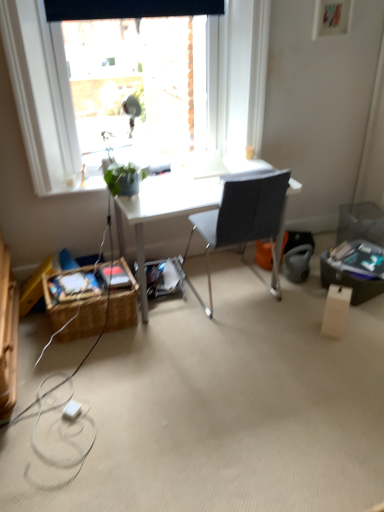
Describe the element at coordinates (40, 92) in the screenshot. I see `transparent glass window at upper center` at that location.

Image resolution: width=384 pixels, height=512 pixels. What do you see at coordinates (336, 311) in the screenshot? I see `white cardboard box at lower right` at bounding box center [336, 311].

Identify the location of gray fabric chair at center. [242, 220].

Where is `green matte plant at upper left`? The image size is (384, 512). green matte plant at upper left is located at coordinates (124, 178).

Where is `transparent glass window at upper center`? This screenshot has width=384, height=512. transparent glass window at upper center is located at coordinates (40, 92).

Is green matte plant at upper left completely or partially outside of white cardboard box at lower right?

green matte plant at upper left is positioned outside white cardboard box at lower right.

In the image, is green matte plant at upper left positioned in front of or behind white cardboard box at lower right?

In the image, green matte plant at upper left appears in front of white cardboard box at lower right.

Is green matte plant at upper left placed right next to white cardboard box at lower right?

No, green matte plant at upper left is not in contact with white cardboard box at lower right.

Considering the positions of objects green matte plant at upper left and white cardboard box at lower right in the image provided, who is more to the left, green matte plant at upper left or white cardboard box at lower right?

green matte plant at upper left is more to the left.

Can you confirm if gray fabric chair at center is positioned to the right of wooden picture frame at upper right?

No.

From a real-world perspective, between gray fabric chair at center and wooden picture frame at upper right, who is vertically lower?

gray fabric chair at center.

Is gray fabric chair at center oriented towards wooden picture frame at upper right?

No.

From the image's perspective, does gray fabric chair at center appear higher than wooden picture frame at upper right?

No, from the image's perspective, gray fabric chair at center is not over wooden picture frame at upper right.

Who is taller, woven brown picnic basket at lower left or white plastic power outlet at lower left?

Standing taller between the two is woven brown picnic basket at lower left.

From a real-world perspective, between woven brown picnic basket at lower left and white plastic power outlet at lower left, who is vertically higher?

In real-world perspective, woven brown picnic basket at lower left is above.

Is transparent glass window at upper center spatially inside white plastic power outlet at lower left, or outside of it?

transparent glass window at upper center is not enclosed by white plastic power outlet at lower left.

From the image's perspective, would you say transparent glass window at upper center is positioned over white plastic power outlet at lower left?

Yes, from the image's perspective, transparent glass window at upper center is above white plastic power outlet at lower left.

Can you confirm if transparent glass window at upper center is wider than white plastic power outlet at lower left?

Yes, transparent glass window at upper center is wider than white plastic power outlet at lower left.

Considering the sizes of objects transparent glass window at upper center and white plastic power outlet at lower left in the image provided, who is taller, transparent glass window at upper center or white plastic power outlet at lower left?

transparent glass window at upper center is taller.

Would you say green matte plant at upper left is to the left or to the right of woven brown picnic basket at lower left in the picture?

In the image, green matte plant at upper left appears on the right side of woven brown picnic basket at lower left.

This screenshot has height=512, width=384. What are the coordinates of `picnic basket that appears behind the green matte plant at upper left` in the screenshot? It's located at (77, 316).

From a real-world perspective, is green matte plant at upper left physically below woven brown picnic basket at lower left?

Incorrect, from a real-world perspective, green matte plant at upper left is higher than woven brown picnic basket at lower left.

From a real-world perspective, between woven brown picnic basket at lower left and gray fabric chair at center, who is vertically lower?

woven brown picnic basket at lower left is physically lower.

Based on the photo, between woven brown picnic basket at lower left and gray fabric chair at center, which one is positioned in front?

gray fabric chair at center is in front.

Based on the photo, is woven brown picnic basket at lower left positioned far away from gray fabric chair at center?

No, there isn't a large distance between woven brown picnic basket at lower left and gray fabric chair at center.

Consider the image. From the image's perspective, which one is positioned higher, woven brown picnic basket at lower left or gray fabric chair at center?

gray fabric chair at center, from the image's perspective.

Is the position of transparent glass window at upper center more distant than that of wooden picture frame at upper right?

No, it is in front of wooden picture frame at upper right.

Is wooden picture frame at upper right at the back of transparent glass window at upper center?

No, transparent glass window at upper center's orientation is not away from wooden picture frame at upper right.

From the image's perspective, between transparent glass window at upper center and wooden picture frame at upper right, who is located below?

transparent glass window at upper center appears lower in the image.

Which is closer, (x=235, y=30) or (x=315, y=12)?

Clearly, point (x=235, y=30) is closer to the camera than point (x=315, y=12).

Image resolution: width=384 pixels, height=512 pixels. Identify the location of box below the green matte plant at upper left (from a real-world perspective). (336, 311).

I want to click on picture frame above the gray fabric chair at center (from the image's perspective), so click(331, 17).

Which object lies nearer to the anchor point green matte plant at upper left, woven brown picnic basket at lower left or white cardboard box at lower right?

woven brown picnic basket at lower left lies closer to green matte plant at upper left than the other object.

Estimate the real-world distances between objects in this image. Which object is further from green matte plant at upper left, wooden picture frame at upper right or woven brown picnic basket at lower left?

The object further to green matte plant at upper left is wooden picture frame at upper right.

Estimate the real-world distances between objects in this image. Which object is further from green matte plant at upper left, white plastic power outlet at lower left or transparent glass window at upper center?

white plastic power outlet at lower left lies further to green matte plant at upper left than the other object.

From the image, which object appears to be farther from transparent glass window at upper center, white plastic power outlet at lower left or wooden picture frame at upper right?

white plastic power outlet at lower left is further to transparent glass window at upper center.

Based on their spatial positions, is green matte plant at upper left or white cardboard box at lower right further from transparent glass window at upper center?

white cardboard box at lower right.

Looking at the image, which one is located closer to white cardboard box at lower right, woven brown picnic basket at lower left or white plastic power outlet at lower left?

The object closer to white cardboard box at lower right is woven brown picnic basket at lower left.

Considering their positions, is transparent glass window at upper center positioned further to white cardboard box at lower right than white plastic power outlet at lower left?

white plastic power outlet at lower left is positioned further to the anchor white cardboard box at lower right.

Based on their spatial positions, is white cardboard box at lower right or wooden picture frame at upper right closer to green matte plant at upper left?

Among the two, white cardboard box at lower right is located nearer to green matte plant at upper left.

Where is `chair between green matte plant at upper left and white cardboard box at lower right`? The width and height of the screenshot is (384, 512). chair between green matte plant at upper left and white cardboard box at lower right is located at coordinates (242, 220).

Find the location of a particular element. houseplant situated between woven brown picnic basket at lower left and white cardboard box at lower right from left to right is located at coordinates (124, 178).

You are a GUI agent. You are given a task and a screenshot of the screen. Output one action in this format:
    pyautogui.click(x=<x>, y=<y>)
    Task: Click on the picnic basket between wooden picture frame at upper right and white cardboard box at lower right from top to bottom
    This screenshot has width=384, height=512.
    Given the screenshot: What is the action you would take?
    pyautogui.click(x=77, y=316)

You are a GUI agent. You are given a task and a screenshot of the screen. Output one action in this format:
    pyautogui.click(x=<x>, y=<y>)
    Task: Click on the chair between transparent glass window at upper center and white plastic power outlet at lower left from top to bottom
    Image resolution: width=384 pixels, height=512 pixels.
    Given the screenshot: What is the action you would take?
    pyautogui.click(x=242, y=220)